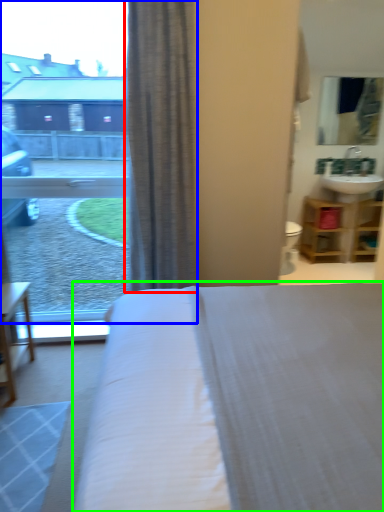
Question: Based on their relative distances, which object is farther from curtain (highlighted by a red box)? Choose from window (highlighted by a blue box) and bed (highlighted by a green box).

Choices:
 (A) window
 (B) bed

Answer: (A)